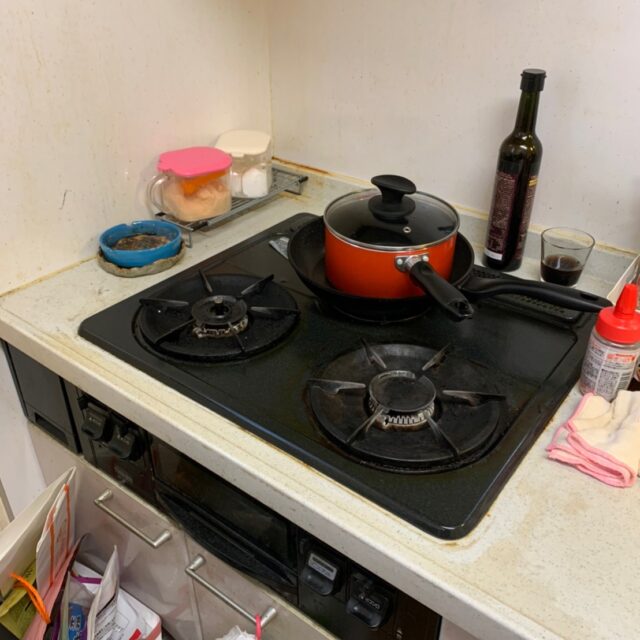
Find the location of a particular element. pot is located at coordinates (372, 259).